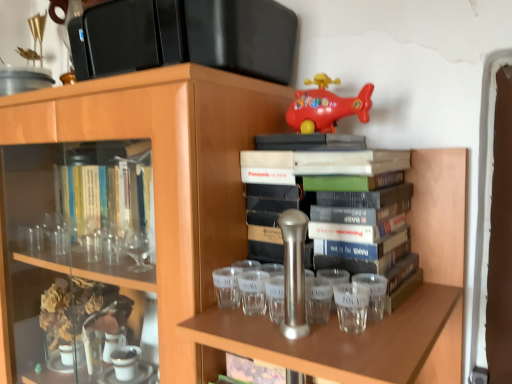
Question: Is transparent glass shot glass at center, which ranks as the 1th shot glass in left-to-right order, aimed at transparent glass shot glass at right, the 3th shot glass viewed from the left?

Choices:
 (A) no
 (B) yes

Answer: (A)

Question: Is transparent glass shot glass at center, the third shot glass positioned from the right, wider than transparent glass shot glass at right, the 3th shot glass viewed from the left?

Choices:
 (A) yes
 (B) no

Answer: (B)

Question: Are transparent glass shot glass at center, the third shot glass positioned from the right, and transparent glass shot glass at right, the 3th shot glass viewed from the left, located far from each other?

Choices:
 (A) no
 (B) yes

Answer: (A)

Question: Can you confirm if transparent glass shot glass at center, which ranks as the 1th shot glass in left-to-right order, is bigger than transparent glass shot glass at right, the first shot glass from the right?

Choices:
 (A) no
 (B) yes

Answer: (A)

Question: Is transparent glass shot glass at center, the third shot glass positioned from the right, at the right side of transparent glass shot glass at right, the first shot glass from the right?

Choices:
 (A) yes
 (B) no

Answer: (B)

Question: In terms of width, does transparent glass shot glass at center, which ranks as the 1th shot glass in left-to-right order, look wider or thinner when compared to rubber red airplane at upper center?

Choices:
 (A) thin
 (B) wide

Answer: (A)

Question: Is transparent glass shot glass at center, which ranks as the 1th shot glass in left-to-right order, situated inside rubber red airplane at upper center or outside?

Choices:
 (A) outside
 (B) inside

Answer: (A)

Question: Looking at the image, does transparent glass shot glass at center, which ranks as the 1th shot glass in left-to-right order, seem bigger or smaller compared to rubber red airplane at upper center?

Choices:
 (A) big
 (B) small

Answer: (B)

Question: From a real-world perspective, is transparent glass shot glass at center, which ranks as the 1th shot glass in left-to-right order, positioned above or below rubber red airplane at upper center?

Choices:
 (A) above
 (B) below

Answer: (B)

Question: Is rubber red airplane at upper center situated inside transparent glass shot glass at center, the third shot glass positioned from the right, or outside?

Choices:
 (A) inside
 (B) outside

Answer: (B)

Question: Considering the positions of rubber red airplane at upper center and transparent glass shot glass at center, the third shot glass positioned from the right, in the image, is rubber red airplane at upper center wider or thinner than transparent glass shot glass at center, the third shot glass positioned from the right,?

Choices:
 (A) wide
 (B) thin

Answer: (A)

Question: From a real-world perspective, is rubber red airplane at upper center positioned above or below transparent glass shot glass at center, the third shot glass positioned from the right?

Choices:
 (A) below
 (B) above

Answer: (B)

Question: From the image's perspective, is rubber red airplane at upper center located above or below transparent glass shot glass at center, the third shot glass positioned from the right?

Choices:
 (A) above
 (B) below

Answer: (A)

Question: Looking at their shapes, would you say transparent glass shot glass at right, the first shot glass from the right, is wider or thinner than transparent glass shot glass at center, which ranks as the second shot glass in right-to-left order?

Choices:
 (A) thin
 (B) wide

Answer: (A)

Question: From the image's perspective, is transparent glass shot glass at right, the 3th shot glass viewed from the left, located above or below transparent glass shot glass at center, which ranks as the second shot glass in right-to-left order?

Choices:
 (A) below
 (B) above

Answer: (A)